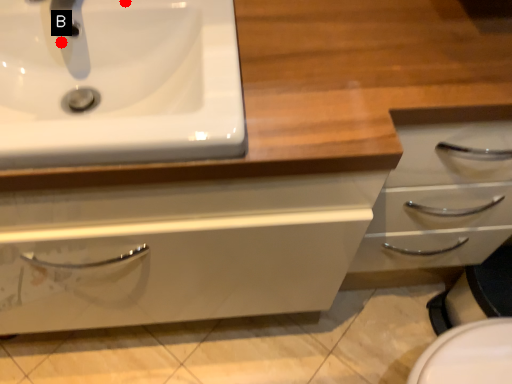
Question: Two points are circled on the image, labeled by A and B beside each circle. Which of the following is the closest to the observer?

Choices:
 (A) A is closer
 (B) B is closer

Answer: (A)